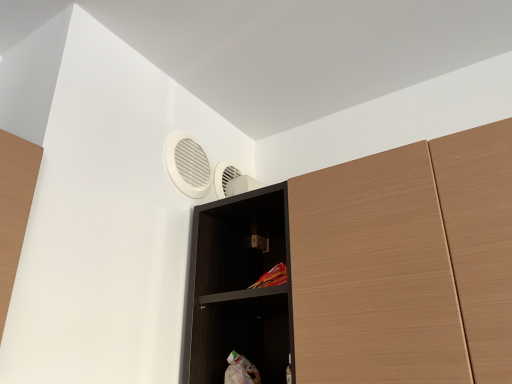
I want to click on black wood shelf at upper center, so click(238, 288).

Find the location of a particular element. white plastic air conditioning at upper center is located at coordinates (188, 165).

Based on the photo, from the image's perspective, is wooden cupboard at upper right located above or below white plastic air conditioning at upper center?

Based on their image positions, wooden cupboard at upper right is located beneath white plastic air conditioning at upper center.

Consider the image. Would you say wooden cupboard at upper right is inside or outside white plastic air conditioning at upper center?

wooden cupboard at upper right is spatially situated outside white plastic air conditioning at upper center.

Is wooden cupboard at upper right not close to white plastic air conditioning at upper center?

Actually, wooden cupboard at upper right and white plastic air conditioning at upper center are a little close together.

Which is more to the left, wooden cupboard at upper right or white plastic air conditioning at upper center?

Positioned to the left is white plastic air conditioning at upper center.

Is black wood shelf at upper center not near wooden cupboard at upper right?

They are positioned close to each other.

Does point (212, 334) lie in front of point (260, 366)?

Yes, point (212, 334) is in front of point (260, 366).

How different are the orientations of black wood shelf at upper center and wooden cupboard at upper right in degrees?

The angle between the facing direction of black wood shelf at upper center and the facing direction of wooden cupboard at upper right is 2.51e-05 degrees.

Between black wood shelf at upper center and wooden cupboard at upper right, which one appears on the right side from the viewer's perspective?

Positioned to the right is wooden cupboard at upper right.

The height and width of the screenshot is (384, 512). Find the location of `shelf in front of the white plastic air conditioning at upper center`. shelf in front of the white plastic air conditioning at upper center is located at coordinates (238, 288).

From the image's perspective, is white plastic air conditioning at upper center located above or below black wood shelf at upper center?

white plastic air conditioning at upper center is above black wood shelf at upper center.

How distant is white plastic air conditioning at upper center from black wood shelf at upper center?

9.95 inches.

Is white plastic air conditioning at upper center thinner than black wood shelf at upper center?

Yes, white plastic air conditioning at upper center is thinner than black wood shelf at upper center.

From the image's perspective, who appears lower, black wood shelf at upper center or white plastic air conditioning at upper center?

From the image's view, black wood shelf at upper center is below.

The height and width of the screenshot is (384, 512). What are the coordinates of `air conditioning that is on the left side of black wood shelf at upper center` in the screenshot? It's located at (188, 165).

Who is bigger, black wood shelf at upper center or white plastic air conditioning at upper center?

With larger size is black wood shelf at upper center.

Is black wood shelf at upper center positioned with its back to white plastic air conditioning at upper center?

No, black wood shelf at upper center is not facing the opposite direction of white plastic air conditioning at upper center.

Considering the relative sizes of white plastic air conditioning at upper center and wooden cupboard at upper right in the image provided, is white plastic air conditioning at upper center thinner than wooden cupboard at upper right?

Indeed, white plastic air conditioning at upper center has a lesser width compared to wooden cupboard at upper right.

From a real-world perspective, is white plastic air conditioning at upper center positioned above or below wooden cupboard at upper right?

Clearly, from a real-world perspective, white plastic air conditioning at upper center is above wooden cupboard at upper right.

What's the angular difference between white plastic air conditioning at upper center and wooden cupboard at upper right's facing directions?

There is a 88.5-degree angle between the facing directions of white plastic air conditioning at upper center and wooden cupboard at upper right.

From the image's perspective, who appears lower, white plastic air conditioning at upper center or wooden cupboard at upper right?

wooden cupboard at upper right.

Looking at this image, is wooden cupboard at upper right to the left of black wood shelf at upper center from the viewer's perspective?

No.

From the image's perspective, which one is positioned higher, wooden cupboard at upper right or black wood shelf at upper center?

wooden cupboard at upper right.

Considering the sizes of wooden cupboard at upper right and black wood shelf at upper center in the image, is wooden cupboard at upper right wider or thinner than black wood shelf at upper center?

wooden cupboard at upper right is wider than black wood shelf at upper center.

Considering the relative sizes of wooden cupboard at upper right and black wood shelf at upper center in the image provided, is wooden cupboard at upper right taller than black wood shelf at upper center?

No, wooden cupboard at upper right is not taller than black wood shelf at upper center.

Where is `cupboard that appears below the white plastic air conditioning at upper center (from the image's perspective)`? cupboard that appears below the white plastic air conditioning at upper center (from the image's perspective) is located at coordinates (362, 270).

The image size is (512, 384). In order to click on cupboard that is under the black wood shelf at upper center (from a real-world perspective) in this screenshot , I will do `click(362, 270)`.

From the image, which object appears to be nearer to white plastic air conditioning at upper center, wooden cupboard at upper right or black wood shelf at upper center?

Among the two, black wood shelf at upper center is located nearer to white plastic air conditioning at upper center.

Looking at the image, which one is located closer to wooden cupboard at upper right, white plastic air conditioning at upper center or black wood shelf at upper center?

The object closer to wooden cupboard at upper right is black wood shelf at upper center.

When comparing their distances from white plastic air conditioning at upper center, does black wood shelf at upper center or wooden cupboard at upper right seem closer?

black wood shelf at upper center.

Looking at the image, which one is located closer to black wood shelf at upper center, wooden cupboard at upper right or white plastic air conditioning at upper center?

wooden cupboard at upper right lies closer to black wood shelf at upper center than the other object.

Estimate the real-world distances between objects in this image. Which object is further from wooden cupboard at upper right, black wood shelf at upper center or white plastic air conditioning at upper center?

white plastic air conditioning at upper center lies further to wooden cupboard at upper right than the other object.

From the image, which object appears to be nearer to black wood shelf at upper center, white plastic air conditioning at upper center or wooden cupboard at upper right?

wooden cupboard at upper right is closer to black wood shelf at upper center.

I want to click on shelf between wooden cupboard at upper right and white plastic air conditioning at upper center along the z-axis, so click(238, 288).